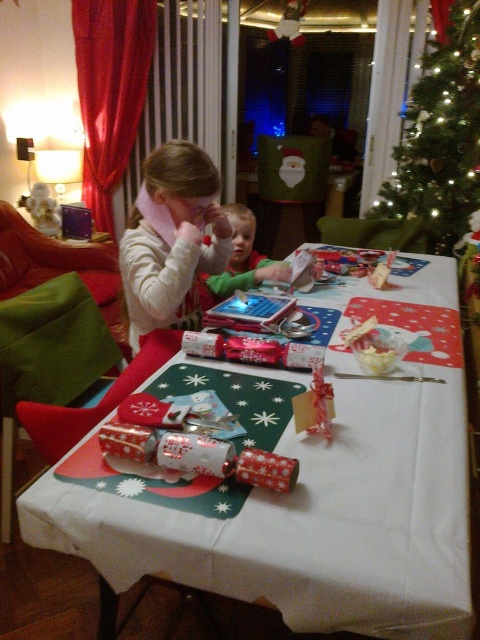
Does point (173, 564) come closer to viewer compared to point (454, 20)?

Yes.

Based on the photo, can you confirm if white paper table at center is wider than green textured christmas tree at upper right?

Indeed, white paper table at center has a greater width compared to green textured christmas tree at upper right.

Is point (371, 461) in front of point (454, 141)?

Yes, point (371, 461) is in front of point (454, 141).

Find the location of a particular element. This screenshot has width=480, height=640. white paper table at center is located at coordinates (312, 518).

Is green textured christmas tree at upper right thinner than matte white sweater at upper left?

Incorrect, green textured christmas tree at upper right's width is not less than matte white sweater at upper left's.

Is point (464, 3) behind point (148, 298)?

Yes.

Which is in front, point (471, 209) or point (202, 189)?

Point (202, 189) is in front.

The width and height of the screenshot is (480, 640). I want to click on green textured christmas tree at upper right, so click(441, 136).

The width and height of the screenshot is (480, 640). Describe the element at coordinates (312, 518) in the screenshot. I see `white paper table at center` at that location.

Is white paper table at center to the right of green matte shirt at center from the viewer's perspective?

Yes, white paper table at center is to the right of green matte shirt at center.

Locate an element on the screen. This screenshot has width=480, height=640. white paper table at center is located at coordinates (312, 518).

Where is `white paper table at center`? The width and height of the screenshot is (480, 640). white paper table at center is located at coordinates (312, 518).